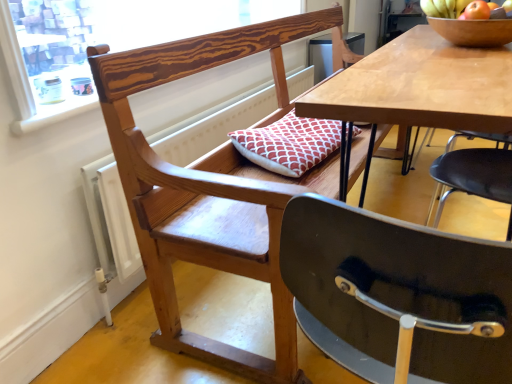
Question: Considering their positions, is wooden radiator at left located in front of or behind shiny golden bananas at upper right?

Choices:
 (A) front
 (B) behind

Answer: (A)

Question: Looking at the image, does wooden radiator at left seem bigger or smaller compared to shiny golden bananas at upper right?

Choices:
 (A) big
 (B) small

Answer: (A)

Question: Based on their relative distances, which object is nearer to the wooden frame at upper left?

Choices:
 (A) shiny golden bananas at upper right
 (B) wooden radiator at left
 (C) wooden bowl at upper right
 (D) wooden chair with cushion at center

Answer: (B)

Question: Estimate the real-world distances between objects in this image. Which object is closer to the wooden frame at upper left?

Choices:
 (A) wooden bowl at upper right
 (B) wooden radiator at left
 (C) wooden chair with cushion at center
 (D) shiny golden bananas at upper right

Answer: (B)